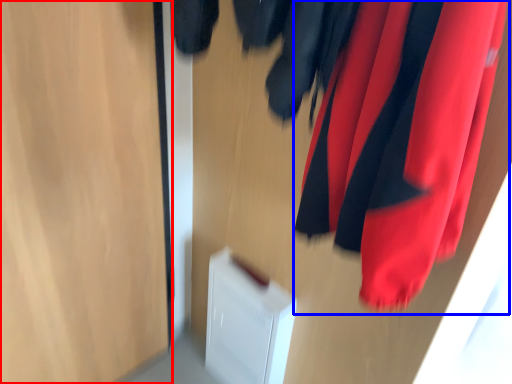
Question: Which object is further to the camera taking this photo, glass door (highlighted by a red box) or curtain (highlighted by a blue box)?

Choices:
 (A) glass door
 (B) curtain

Answer: (A)